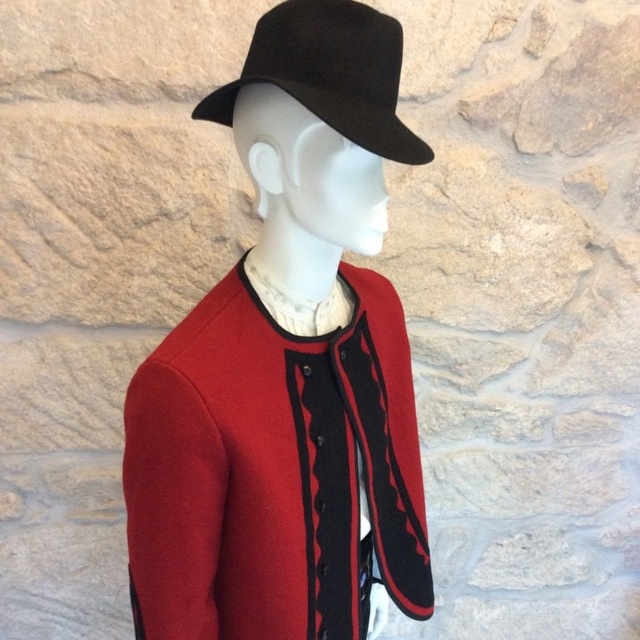
You are a fashion designer trying to place a matte black hat at center and a black felt fedora at upper center on a mannequin. Which hat should you choose if you want the one that is bigger in size?

The matte black hat at center has a larger size compared to the black felt fedora at upper center, so you should choose the matte black hat at center.

You are a fashion designer who wants to place a new accessory on the mannequin. The accessory must be placed exactly at point (289, 369). What is the current object at that location?

The point (289, 369) indicates the location of the matte black hat at center.